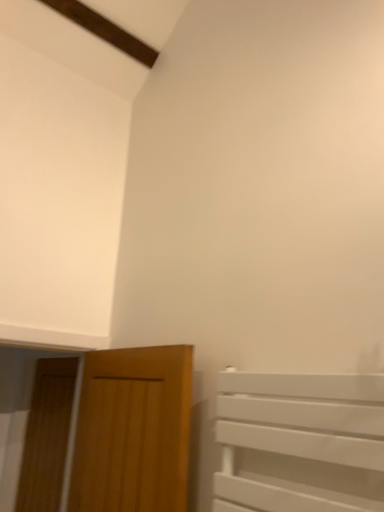
Question: Considering the relative sizes of wooden door at lower left, the first door from the front, and wooden door at left, which ranks as the 1th door in left-to-right order, in the image provided, is wooden door at lower left, the first door from the front, taller than wooden door at left, which ranks as the 1th door in left-to-right order,?

Choices:
 (A) yes
 (B) no

Answer: (B)

Question: Is wooden door at lower left, marked as the 2th door in a left-to-right arrangement, thinner than wooden door at left, which is counted as the second door, starting from the front?

Choices:
 (A) yes
 (B) no

Answer: (B)

Question: Is wooden door at lower left, the first door from the front, not inside wooden door at left, acting as the 2th door starting from the right?

Choices:
 (A) no
 (B) yes

Answer: (B)

Question: Can you confirm if wooden door at lower left, the first door from the front, is positioned to the left of wooden door at left, acting as the 2th door starting from the right?

Choices:
 (A) yes
 (B) no

Answer: (B)

Question: Is wooden door at lower left, the second door in the back-to-front sequence, at the right side of wooden door at left, which is counted as the second door, starting from the front?

Choices:
 (A) yes
 (B) no

Answer: (A)

Question: Would you say wooden door at lower left, the first door from the front, contains wooden door at left, which is the first door in back-to-front order?

Choices:
 (A) yes
 (B) no

Answer: (B)

Question: Considering the relative positions of wooden door at left, which is the first door in back-to-front order, and wooden door at lower left, marked as the 2th door in a left-to-right arrangement, in the image provided, is wooden door at left, which is the first door in back-to-front order, to the left of wooden door at lower left, marked as the 2th door in a left-to-right arrangement, from the viewer's perspective?

Choices:
 (A) yes
 (B) no

Answer: (A)

Question: Does wooden door at left, which ranks as the 1th door in left-to-right order, have a smaller size compared to wooden door at lower left, the second door in the back-to-front sequence?

Choices:
 (A) no
 (B) yes

Answer: (B)

Question: From a real-world perspective, is wooden door at left, acting as the 2th door starting from the right, located higher than wooden door at lower left, which is the 1th door in right-to-left order?

Choices:
 (A) yes
 (B) no

Answer: (B)

Question: Is wooden door at left, which is the first door in back-to-front order, behind wooden door at lower left, marked as the 2th door in a left-to-right arrangement?

Choices:
 (A) no
 (B) yes

Answer: (B)

Question: Is wooden door at left, which is the first door in back-to-front order, far from wooden door at lower left, marked as the 2th door in a left-to-right arrangement?

Choices:
 (A) no
 (B) yes

Answer: (A)

Question: Can you confirm if wooden door at left, acting as the 2th door starting from the right, is taller than wooden door at lower left, marked as the 2th door in a left-to-right arrangement?

Choices:
 (A) yes
 (B) no

Answer: (A)

Question: Looking at the image, does wooden door at left, which is the first door in back-to-front order, seem bigger or smaller compared to wooden door at lower left, marked as the 2th door in a left-to-right arrangement?

Choices:
 (A) big
 (B) small

Answer: (B)